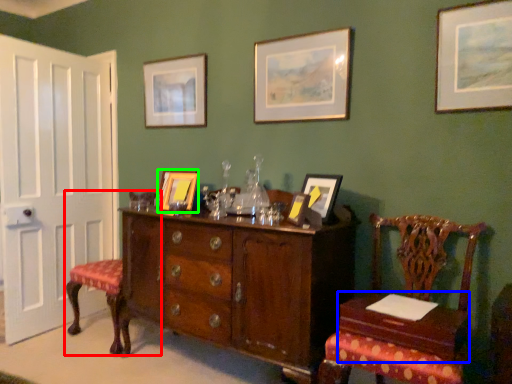
Question: Which object is the closest to the chair (highlighted by a red box)? Choose among these: table (highlighted by a blue box) or picture frame (highlighted by a green box).

Choices:
 (A) table
 (B) picture frame

Answer: (B)